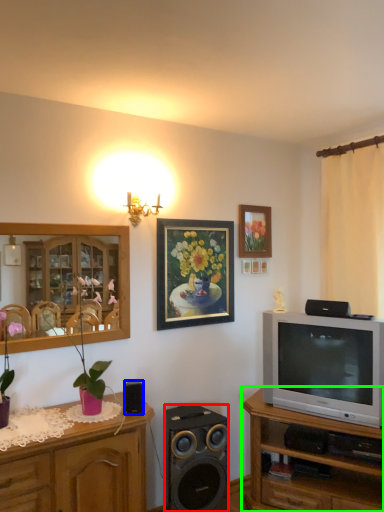
Question: Which object is the closest to the speaker (highlighted by a red box)? Choose among these: speaker (highlighted by a blue box) or cabinetry (highlighted by a green box).

Choices:
 (A) speaker
 (B) cabinetry

Answer: (B)